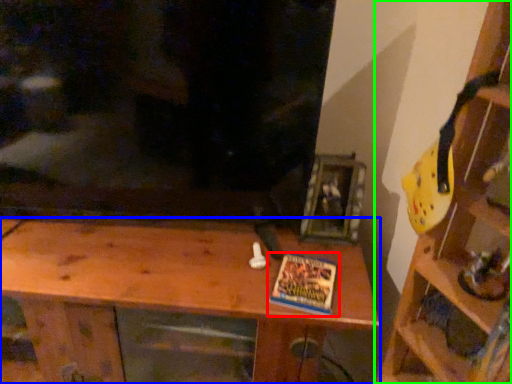
Question: Which is nearer to the book (highlighted by a red box)? shelf (highlighted by a blue box) or shelf (highlighted by a green box).

Choices:
 (A) shelf
 (B) shelf

Answer: (A)